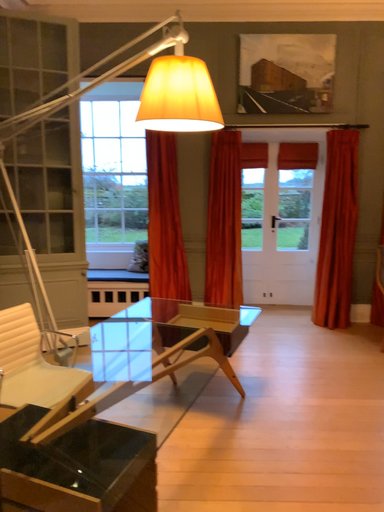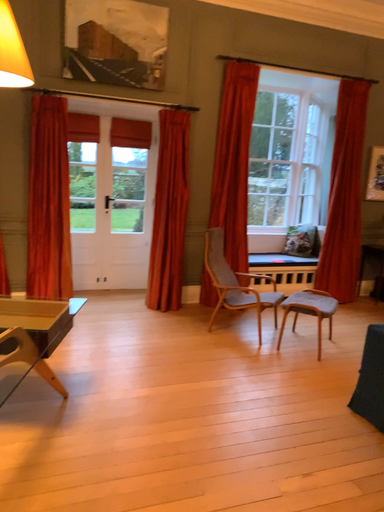
Question: How did the camera likely rotate when shooting the video?

Choices:
 (A) rotated right
 (B) rotated left

Answer: (A)